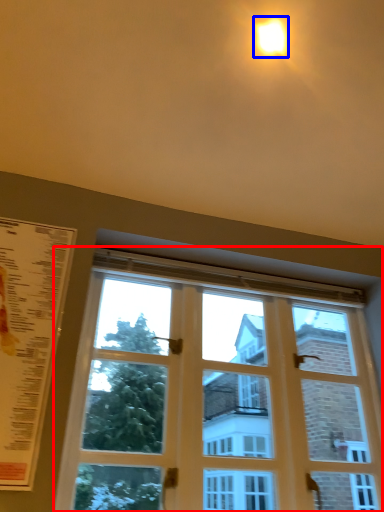
Question: Which point is further to the camera, window (highlighted by a red box) or light (highlighted by a blue box)?

Choices:
 (A) window
 (B) light

Answer: (B)